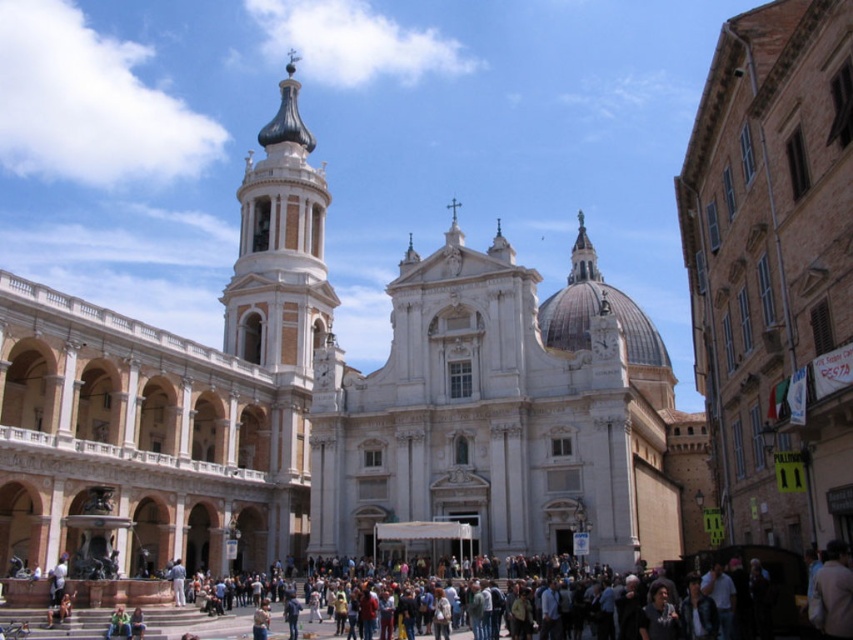
Question: Among these points, which one is farthest from the camera?

Choices:
 (A) (299, 209)
 (B) (263, 310)

Answer: (A)

Question: Which object is closer to the camera taking this photo?

Choices:
 (A) white marble bell tower at upper left
 (B) white stone church at center

Answer: (B)

Question: Where is white stone church at center located in relation to white marble bell tower at upper left in the image?

Choices:
 (A) right
 (B) left

Answer: (A)

Question: Can you confirm if white stone church at center is positioned above white marble bell tower at upper left?

Choices:
 (A) no
 (B) yes

Answer: (A)

Question: Is white stone church at center to the right of white marble bell tower at upper left from the viewer's perspective?

Choices:
 (A) no
 (B) yes

Answer: (B)